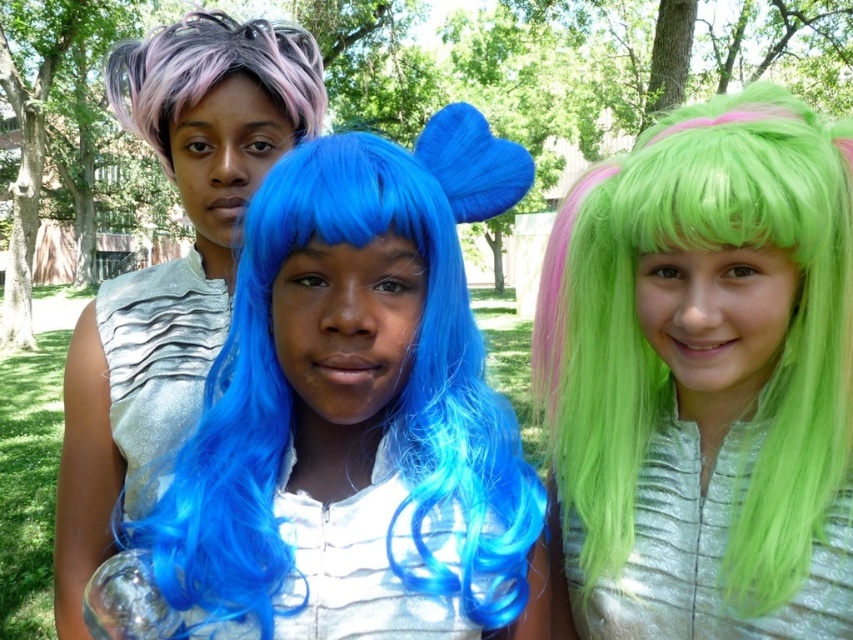
Who is positioned more to the right, blue silky wig at center or matte silver dress at center?

Positioned to the right is blue silky wig at center.

Is blue silky wig at center taller than matte silver dress at center?

No.

Does point (498, 192) lie in front of point (61, 516)?

Yes, point (498, 192) is closer to viewer.

Where is `blue silky wig at center`? Image resolution: width=853 pixels, height=640 pixels. blue silky wig at center is located at coordinates (355, 412).

Is point (247, 156) in front of point (161, 76)?

No, (247, 156) is behind (161, 76).

Which is in front, point (225, 88) or point (170, 177)?

Point (225, 88)

Identify the location of matte silver dress at center. The image size is (853, 640). (171, 262).

Does neon green wig at center appear under pastel purple dreadlocks at upper left?

Yes.

Is neon green wig at center in front of pastel purple dreadlocks at upper left?

Yes, it is in front of pastel purple dreadlocks at upper left.

Is point (660, 220) positioned before point (289, 92)?

Yes.

This screenshot has width=853, height=640. I want to click on neon green wig at center, so (x=703, y=380).